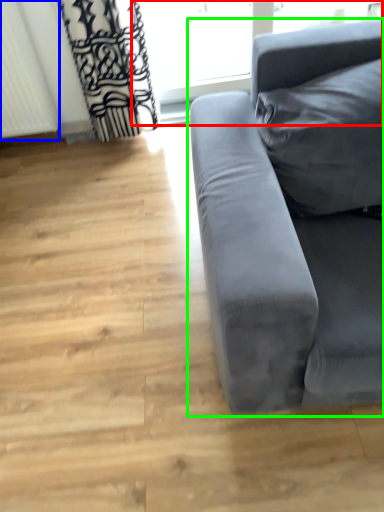
Question: Which is nearer to the window frame (highlighted by a red box)? radiator (highlighted by a blue box) or studio couch (highlighted by a green box).

Choices:
 (A) radiator
 (B) studio couch

Answer: (A)